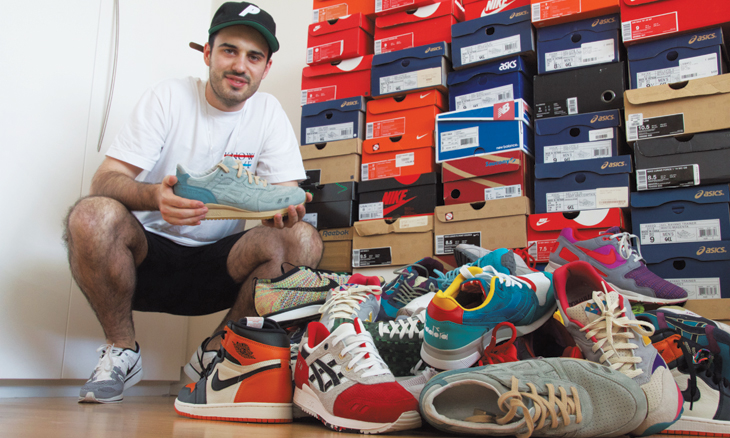
I want to click on brown boxes, so click(x=683, y=107), click(x=502, y=219), click(x=403, y=235), click(x=337, y=241), click(x=338, y=166).